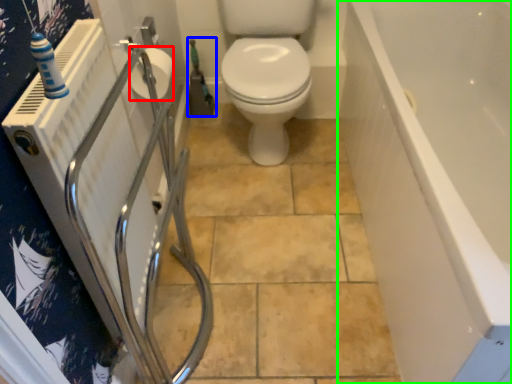
Question: Which object is the closest to the toilet paper (highlighted by a red box)? Choose among these: garden hose (highlighted by a blue box) or bath (highlighted by a green box).

Choices:
 (A) garden hose
 (B) bath

Answer: (A)